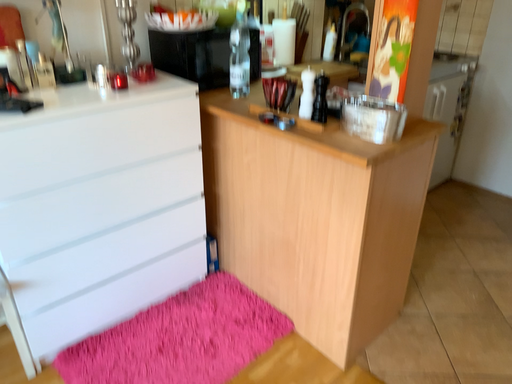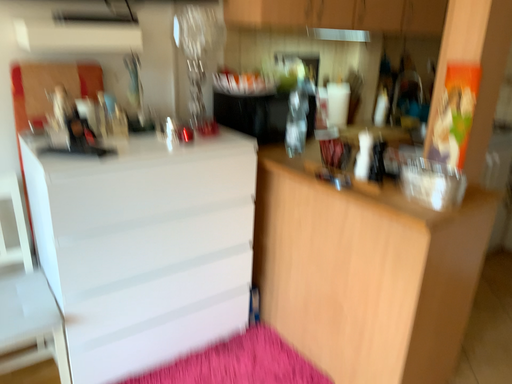
Question: Which way did the camera rotate in the video?

Choices:
 (A) rotated upward
 (B) rotated downward

Answer: (A)